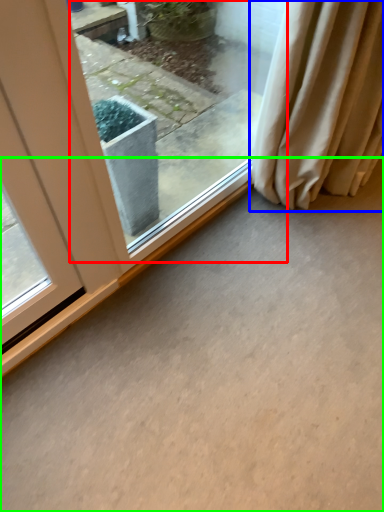
Question: Considering the real-world distances, which object is closest to window (highlighted by a red box)? curtain (highlighted by a blue box) or concrete (highlighted by a green box).

Choices:
 (A) curtain
 (B) concrete

Answer: (A)